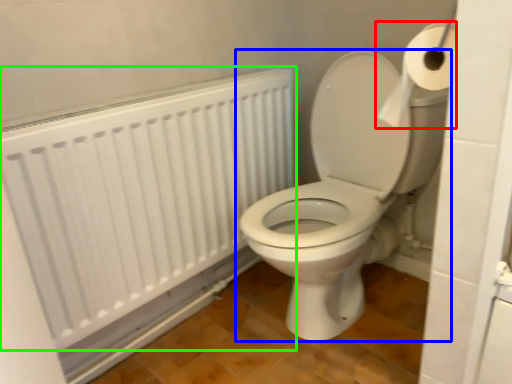
Question: Which is farther away from toilet paper (highlighted by a red box)? toilet (highlighted by a blue box) or radiator (highlighted by a green box)?

Choices:
 (A) toilet
 (B) radiator

Answer: (B)